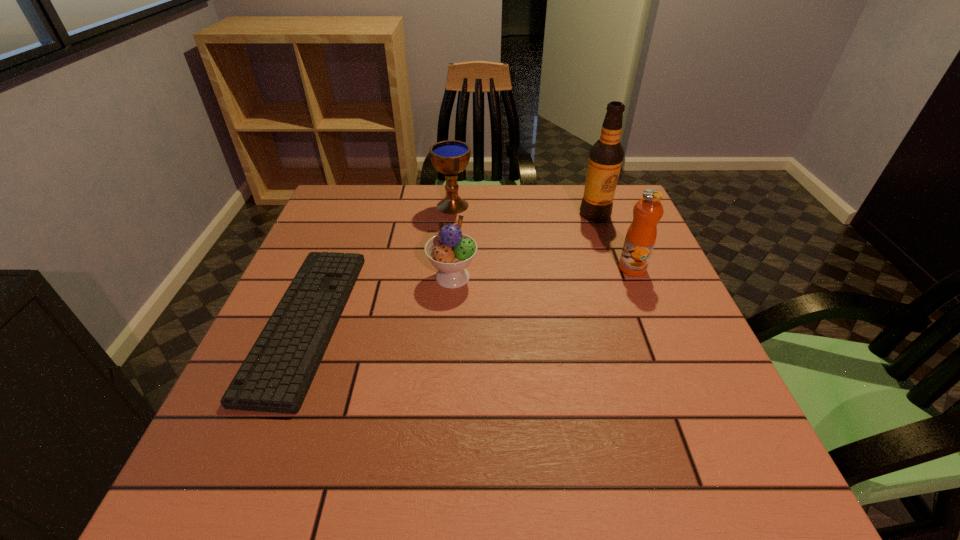
You are a GUI agent. You are given a task and a screenshot of the screen. Output one action in this format:
    pyautogui.click(x=<x>, y=<y>)
    Task: Click on the blank area at the far left corner
    The width and height of the screenshot is (960, 540).
    Given the screenshot: What is the action you would take?
    pyautogui.click(x=359, y=188)

In order to click on free space at the near left corner in this screenshot , I will do `click(291, 469)`.

Locate an element on the screen. vacant area at the far right corner is located at coordinates (603, 223).

This screenshot has height=540, width=960. In order to click on free space between the shortest object and the second shortest object in this screenshot , I will do `click(379, 299)`.

Locate an element on the screen. This screenshot has width=960, height=540. free space between the alcohol and the second shortest object is located at coordinates click(x=524, y=246).

You are a GUI agent. You are given a task and a screenshot of the screen. Output one action in this format:
    pyautogui.click(x=<x>, y=<y>)
    Task: Click on the empty space between the icecream and the fruit juice
    The height and width of the screenshot is (540, 960).
    Given the screenshot: What is the action you would take?
    pyautogui.click(x=542, y=273)

What are the coordinates of `free area in between the fruit juice and the third tallest object` in the screenshot? It's located at (542, 237).

Image resolution: width=960 pixels, height=540 pixels. I want to click on free point between the icecream and the fruit juice, so click(x=542, y=273).

The image size is (960, 540). Find the location of `unoccupied area between the leftmost object and the second shortest object`. unoccupied area between the leftmost object and the second shortest object is located at coordinates (379, 299).

The height and width of the screenshot is (540, 960). In order to click on free point between the second shortest object and the tallest object in this screenshot , I will do `click(524, 246)`.